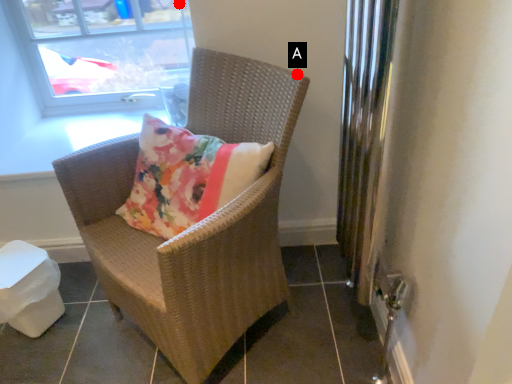
Question: Two points are circled on the image, labeled by A and B beside each circle. Which point is closer to the camera taking this photo?

Choices:
 (A) A is closer
 (B) B is closer

Answer: (A)